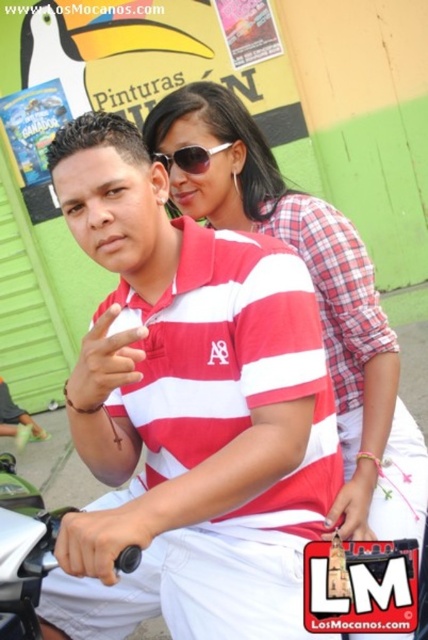
Is white striped polo shirt at center closer to camera compared to matte red shirt at center?

Yes, it is.

Can you confirm if white striped polo shirt at center is bigger than matte red shirt at center?

No.

Find the location of `white striped polo shirt at center`. white striped polo shirt at center is located at coordinates (187, 412).

Between white plastic handlebar at lower left and sunglasses at center, which one appears on the right side from the viewer's perspective?

From the viewer's perspective, sunglasses at center appears more on the right side.

Between white plastic handlebar at lower left and sunglasses at center, which one has less height?

sunglasses at center is shorter.

Does point (29, 618) lie in front of point (184, 152)?

Yes, point (29, 618) is closer to viewer.

Locate an element on the screen. white plastic handlebar at lower left is located at coordinates (23, 554).

Which is below, white striped polo shirt at center or white plastic handlebar at lower left?

Positioned lower is white plastic handlebar at lower left.

Is white striped polo shirt at center closer to the viewer compared to white plastic handlebar at lower left?

Yes, white striped polo shirt at center is in front of white plastic handlebar at lower left.

Identify the location of white striped polo shirt at center. The width and height of the screenshot is (428, 640). (187, 412).